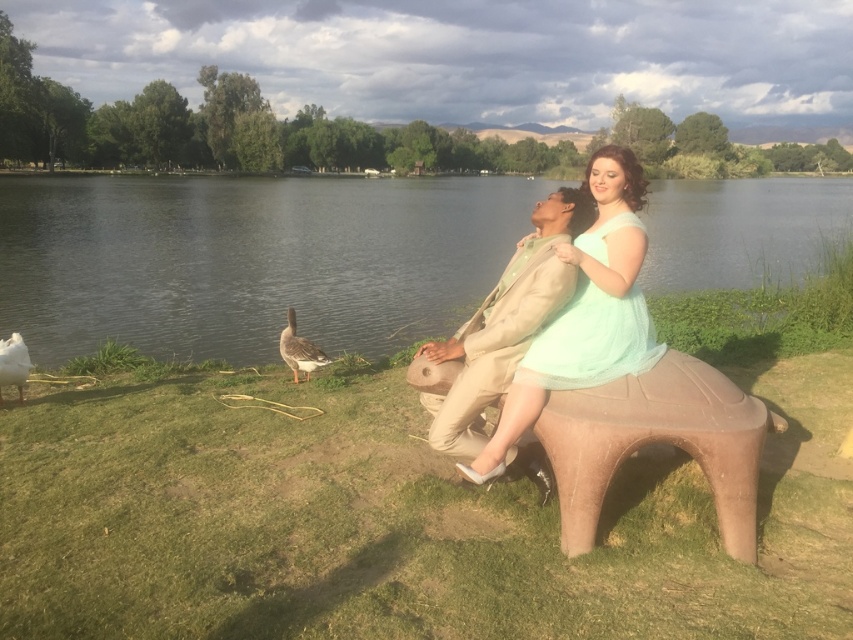
Can you confirm if clear water at center is shorter than beige fabric jacket at center?

Incorrect, clear water at center's height does not fall short of beige fabric jacket at center's.

Is clear water at center above beige fabric jacket at center?

Correct, clear water at center is located above beige fabric jacket at center.

The width and height of the screenshot is (853, 640). Find the location of `clear water at center`. clear water at center is located at coordinates (250, 260).

Where is `clear water at center`? The image size is (853, 640). clear water at center is located at coordinates (250, 260).

Is brown matte duck at lower center shorter than white matte duck at lower left?

Incorrect, brown matte duck at lower center's height does not fall short of white matte duck at lower left's.

Is brown matte duck at lower center to the right of white matte duck at lower left from the viewer's perspective?

Yes, brown matte duck at lower center is to the right of white matte duck at lower left.

Image resolution: width=853 pixels, height=640 pixels. I want to click on brown matte duck at lower center, so click(x=299, y=349).

I want to click on brown plastic bench at center, so [x=657, y=442].

Is point (616, 406) more distant than point (459, 340)?

No, (616, 406) is in front of (459, 340).

Between point (724, 500) and point (579, 225), which one is positioned behind?

The point (579, 225) is more distant.

Where is `brown plastic bench at center`? Image resolution: width=853 pixels, height=640 pixels. brown plastic bench at center is located at coordinates (657, 442).